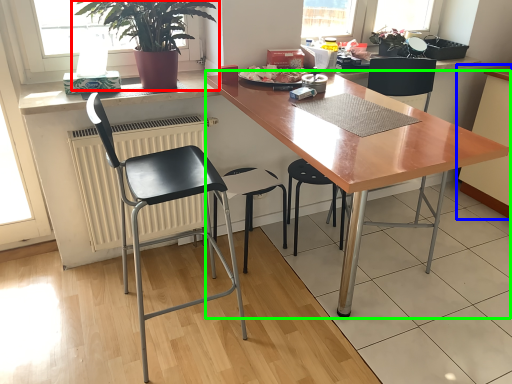
Question: Based on their relative distances, which object is farther from houseplant (highlighted by a red box)? Choose from cabinetry (highlighted by a blue box) and desk (highlighted by a green box).

Choices:
 (A) cabinetry
 (B) desk

Answer: (A)